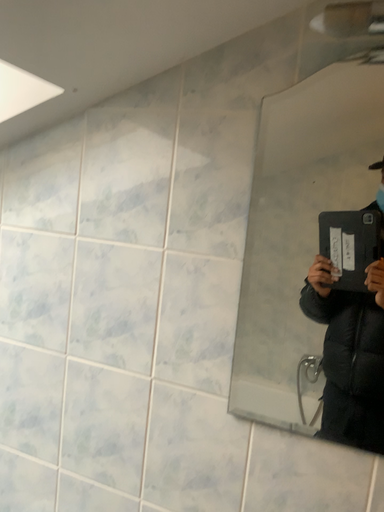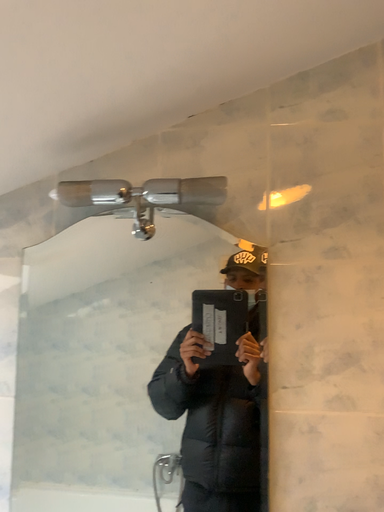
Question: How did the camera likely rotate when shooting the video?

Choices:
 (A) rotated left
 (B) rotated right

Answer: (B)